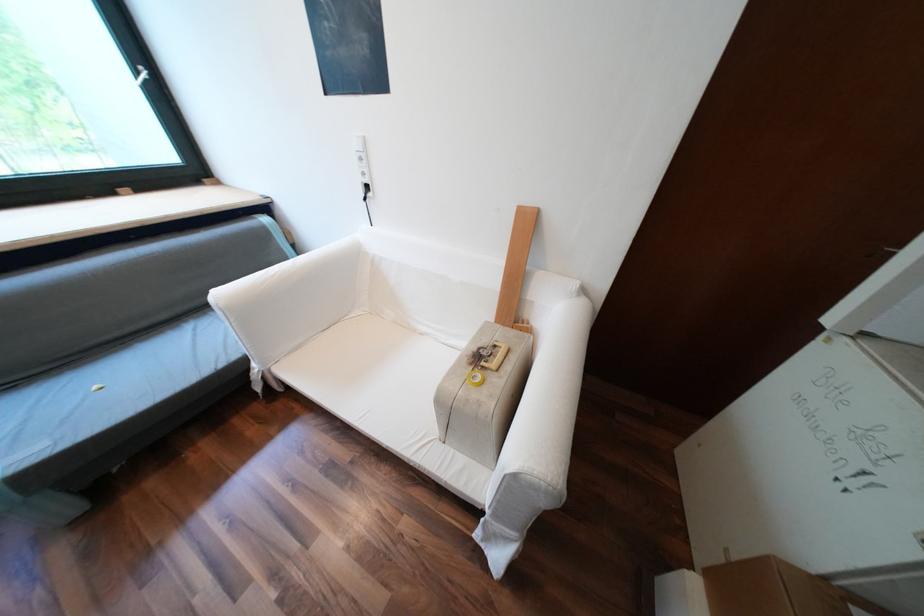
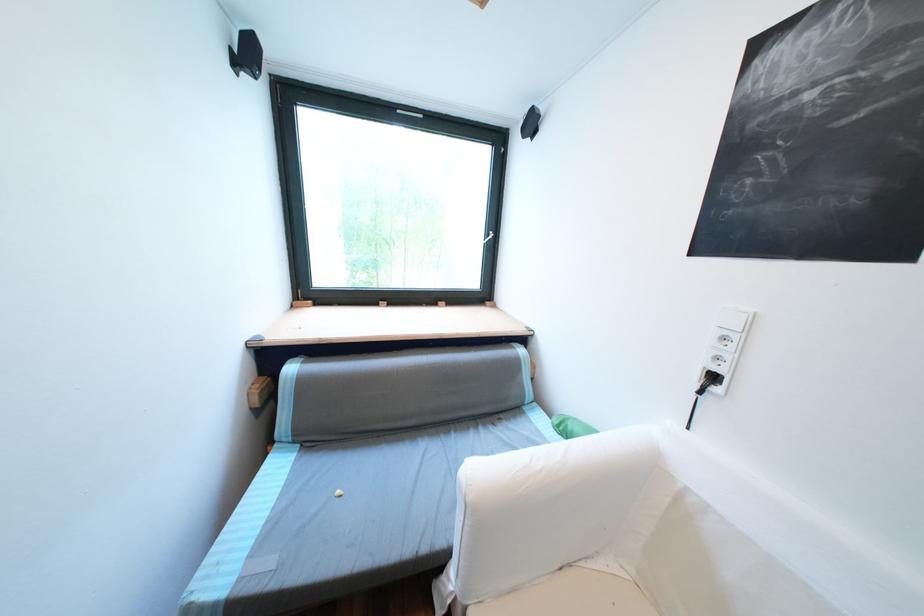
Find the pixel in the second image that matches [232,365] in the first image.

(433, 549)